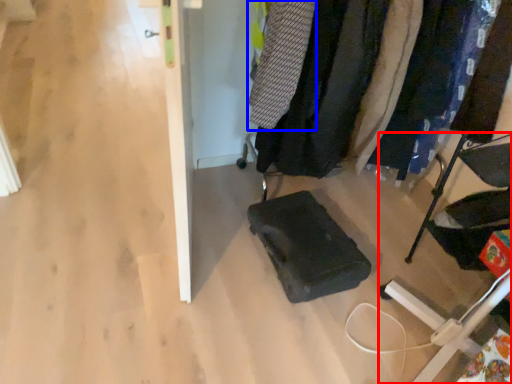
Question: Among these objects, which one is farthest to the camera, furniture (highlighted by a red box) or clothing (highlighted by a blue box)?

Choices:
 (A) furniture
 (B) clothing

Answer: (B)